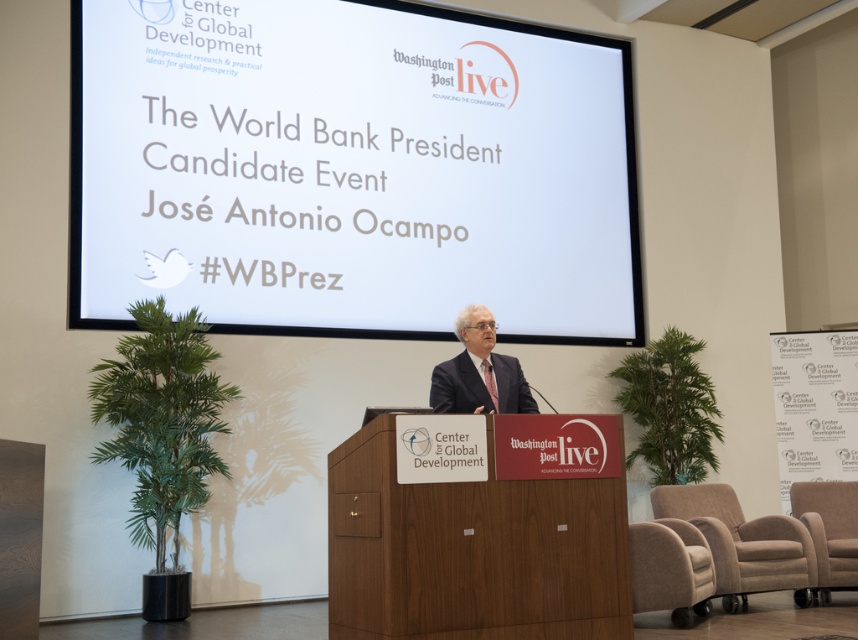
You are an event organizer who needs to ensure that the wooden podium at center is positioned so that the speaker can easily view the white matte projection screen at upper center. Given the spatial relationship between the two, is the podium placed in a way that allows the speaker to see the screen comfortably?

The white matte projection screen at upper center is wider than the wooden podium at center, so the podium is positioned appropriately for the speaker to comfortably see the screen while standing at the center.

In the scene shown: You are a stagehand who needs to place a 24 inch wide banner between the brown fabric armchair at lower right and the beige fabric armchair at lower right. Based on the given information, will the banner fit between them?

The distance between the brown fabric armchair at lower right and beige fabric armchair at lower right is 22.69 inches. Since the banner is 24 inches wide, it will not fit between them as the space is narrower than the banner.

You are an event photographer positioned at the back of the room. You need to capture a clear shot of the wooden podium at center and the brown fabric armchair at lower right. Since you can only focus on one object at a time, which object should you focus on first to ensure the other is still in the frame?

You should focus on the wooden podium at center first because it is in front of the brown fabric armchair at lower right, so if you focus on the podium, the armchair will still be in the background of the frame.